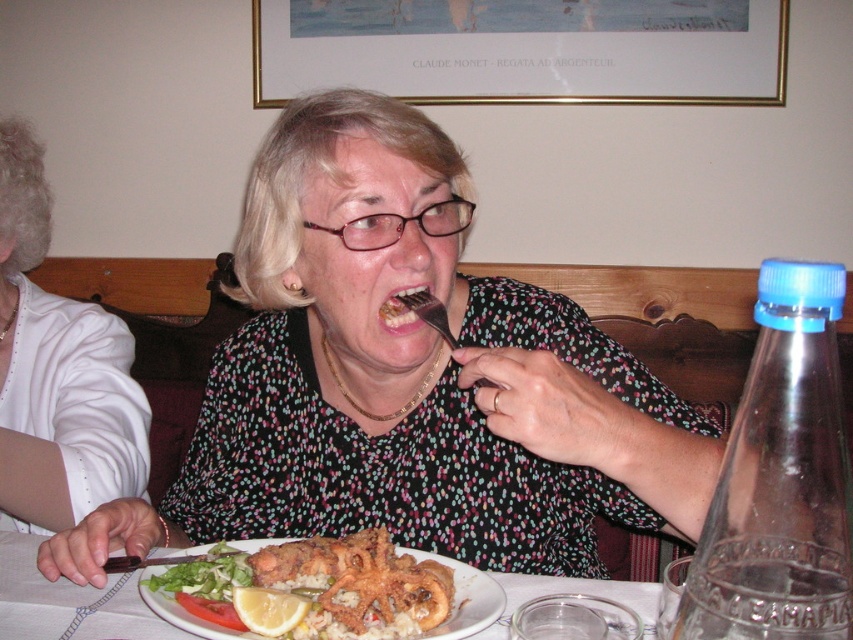
Does white ceramic plate at center come in front of white matte plate at center?

No, it is behind white matte plate at center.

Between white ceramic plate at center and white matte plate at center, which one appears on the left side from the viewer's perspective?

Positioned to the left is white ceramic plate at center.

Between point (10, 579) and point (186, 550), which one is positioned in front?

Point (10, 579) is in front.

Locate an element on the screen. Image resolution: width=853 pixels, height=640 pixels. white ceramic plate at center is located at coordinates (68, 602).

Who is higher up, white satin blouse at left or yellow matte lemon at plate center?

white satin blouse at left is above.

Who is more forward, (21, 477) or (294, 612)?

Point (294, 612) is more forward.

The height and width of the screenshot is (640, 853). What are the coordinates of `white satin blouse at left` in the screenshot? It's located at (57, 371).

Is point (335, 460) positioned after point (32, 538)?

Yes, point (335, 460) is farther from viewer.

Can you confirm if matte black dress at center is shorter than white ceramic plate at center?

In fact, matte black dress at center may be taller than white ceramic plate at center.

The width and height of the screenshot is (853, 640). I want to click on matte black dress at center, so click(405, 380).